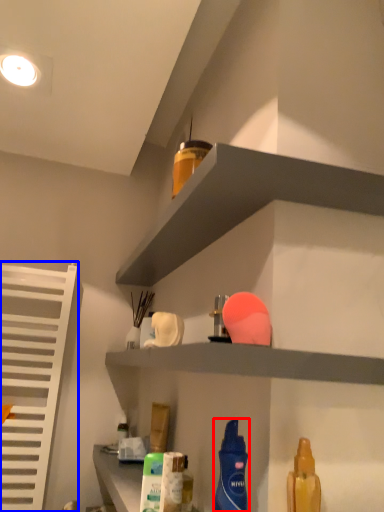
Question: Which of the following is the closest to the observer, cleaning product (highlighted by a red box) or shutter (highlighted by a blue box)?

Choices:
 (A) cleaning product
 (B) shutter

Answer: (A)